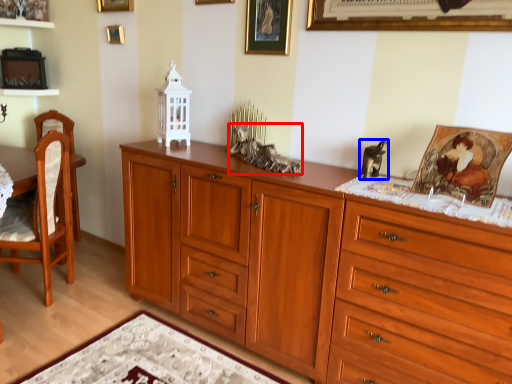
Question: Which of the following is the farthest to the observer, animal (highlighted by a red box) or animal (highlighted by a blue box)?

Choices:
 (A) animal
 (B) animal

Answer: (A)